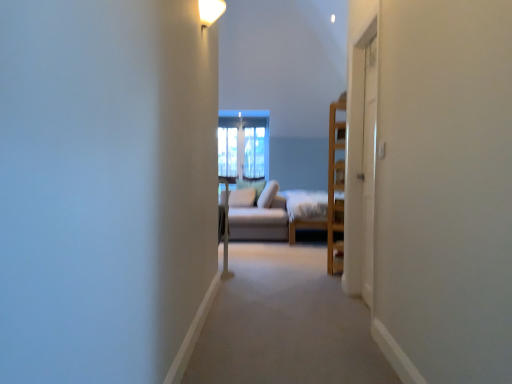
What are the coordinates of `free location to the left of white wooden screen door at right, which ranks as the 2th screen door in right-to-left order` in the screenshot? It's located at (302, 317).